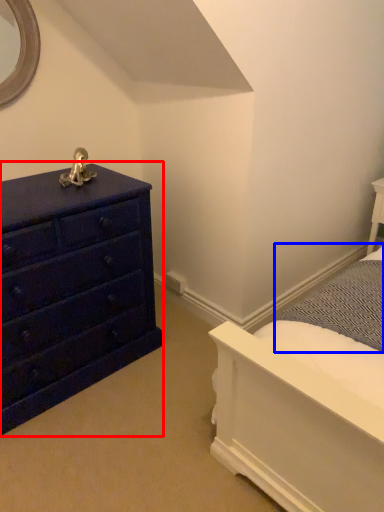
Question: Which of the following is the farthest to the observer, chest of drawers (highlighted by a red box) or bedding (highlighted by a blue box)?

Choices:
 (A) chest of drawers
 (B) bedding

Answer: (B)